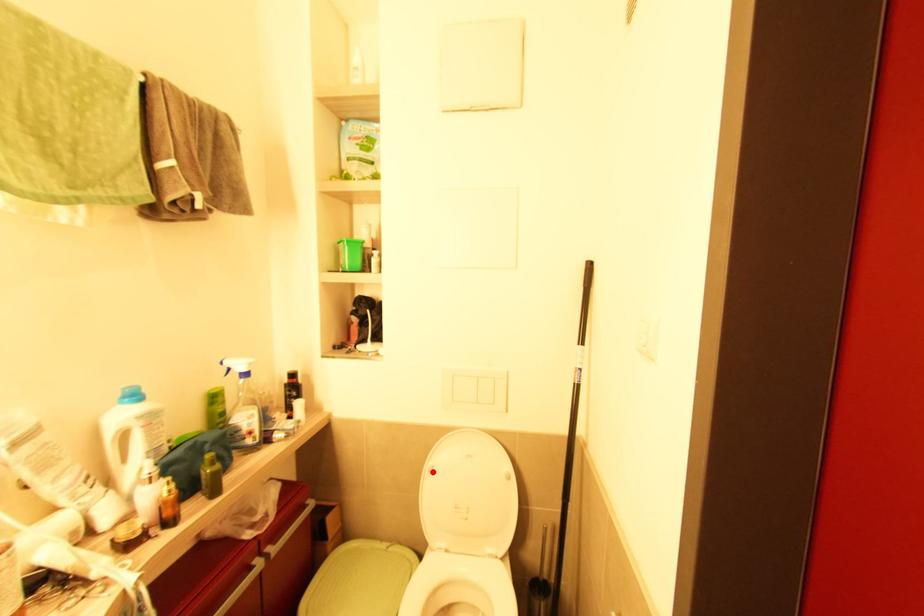
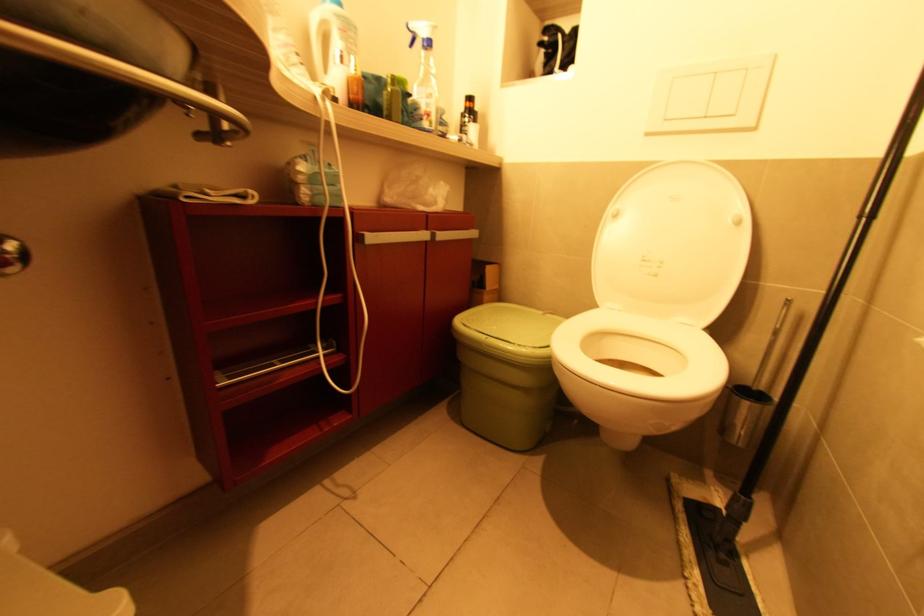
The point at the highlighted location is marked in the first image. Where is the corresponding point in the second image?

(617, 217)